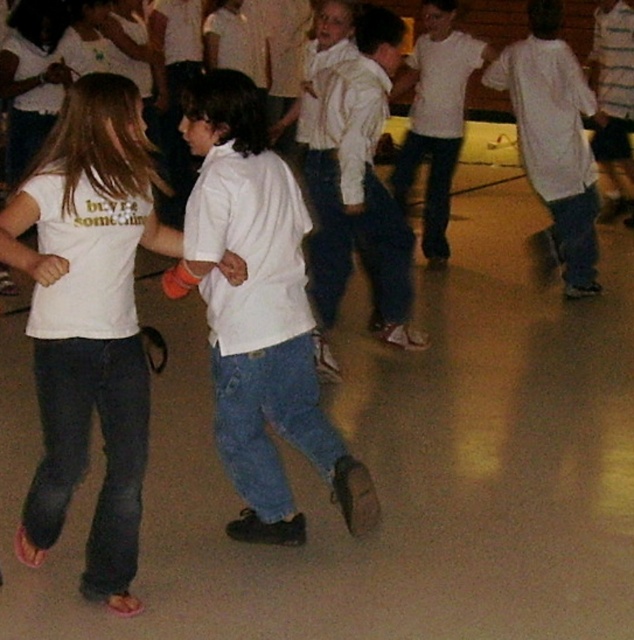
Is white matte shirt at center below white cotton shirt at center?

Correct, white matte shirt at center is located below white cotton shirt at center.

Does white matte shirt at center have a greater height compared to white cotton shirt at center?

Incorrect, white matte shirt at center's height is not larger of white cotton shirt at center's.

What do you see at coordinates (257, 314) in the screenshot? This screenshot has width=634, height=640. I see `white matte shirt at center` at bounding box center [257, 314].

Identify the location of white matte shirt at center. (257, 314).

Is white cotton t-shirt at center positioned in front of white cotton shirt at right?

Yes.

Is white cotton t-shirt at center below white cotton shirt at right?

Correct, white cotton t-shirt at center is located below white cotton shirt at right.

What are the coordinates of `white cotton t-shirt at center` in the screenshot? It's located at (89, 321).

Image resolution: width=634 pixels, height=640 pixels. In order to click on white cotton t-shirt at center in this screenshot , I will do `click(89, 321)`.

Does point (384, 90) come closer to viewer compared to point (557, 49)?

Yes, point (384, 90) is closer to viewer.

Locate an element on the screen. The height and width of the screenshot is (640, 634). white cotton shirt at center is located at coordinates (358, 188).